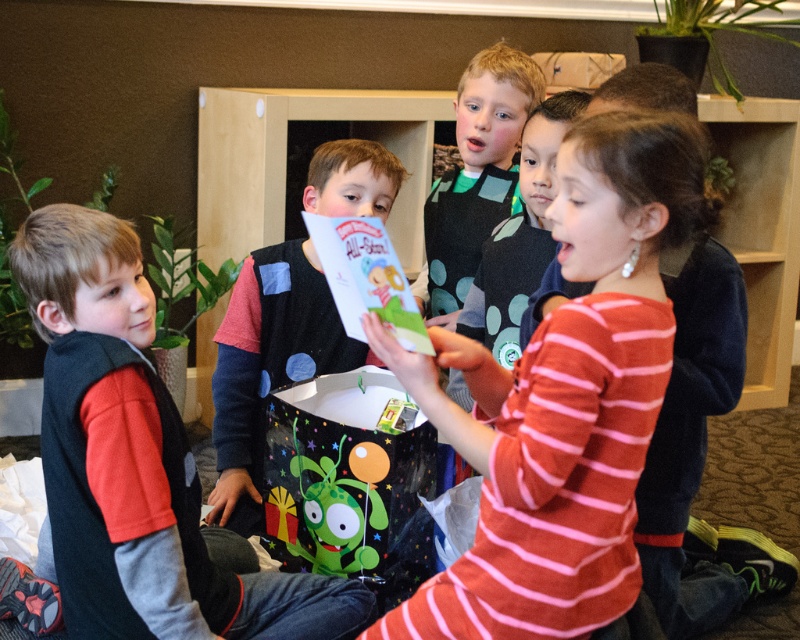
You are organizing a small event and need to arrange the velvet black vest at left and the green matte plush toy at center on a shelf. Which item should be placed on the left side to match the current arrangement?

The velvet black vest at left should be placed on the left side since it is already positioned on the left side of the green matte plush toy at center in the current arrangement.

You are a photographer trying to capture a group photo of the children. The pink striped sweater at center is located at coordinates point 0.623, 0.706. If you want to ensure this child is centered in the frame, which direction should you move the camera? Please provide your answer in terms of up, down, left, or right.

The pink striped sweater at center is already at the center point of the frame since its coordinates are given as point (x=564, y=397). Therefore, no movement is needed to center the camera on the pink striped sweater at center.

You are a fashion designer observing the children in the scene. You notice two black vests, the velvet black vest at left and the matte black vest at center. Which vest is positioned lower in the image?

The velvet black vest at left is positioned lower than the matte black vest at center.